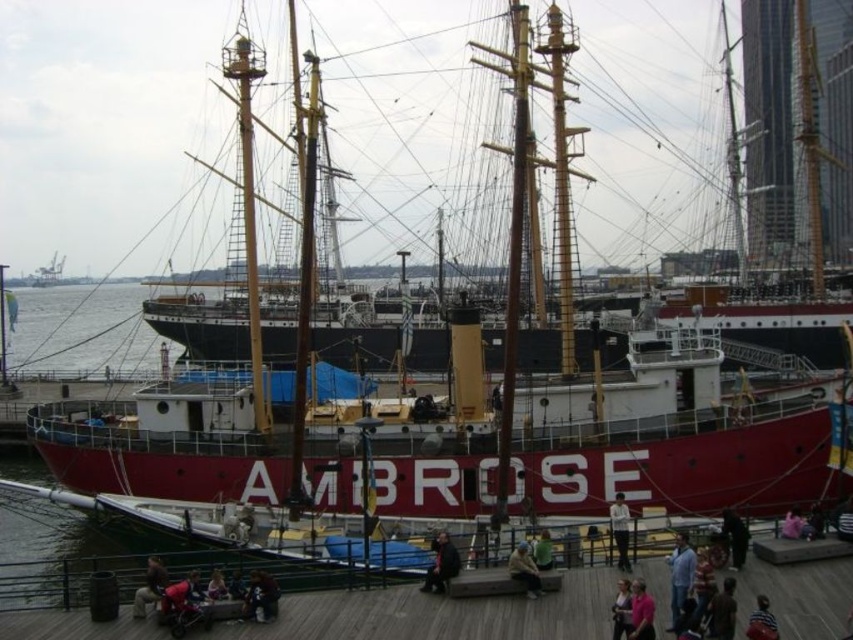
You are standing on the wooden pier and want to greet someone wearing the light blue shirt at lower center and the dark brown leather jacket at center. Which person should you look up towards?

You should look up towards the light blue shirt at lower center because it is located above the dark brown leather jacket at center.

You are standing on the wooden pier and want to greet the person wearing the light brown leather jacket at lower left and the person wearing the pink fabric shirt at lower center. Which person should you approach first if you want to greet them in order from left to right?

You should first greet the person wearing the light brown leather jacket at lower left because it is positioned to the left of the pink fabric shirt at lower center, following the left to right order.